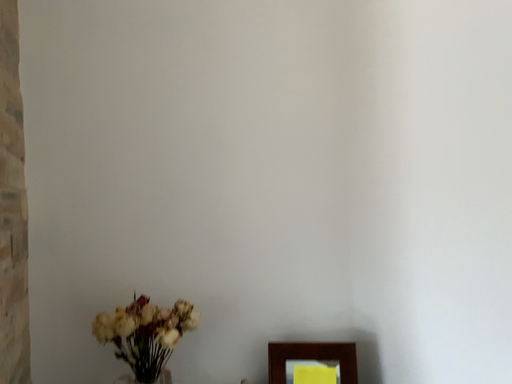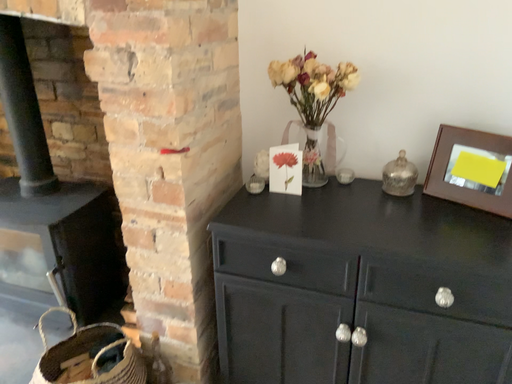
Question: How did the camera likely rotate when shooting the video?

Choices:
 (A) rotated upward
 (B) rotated downward

Answer: (B)